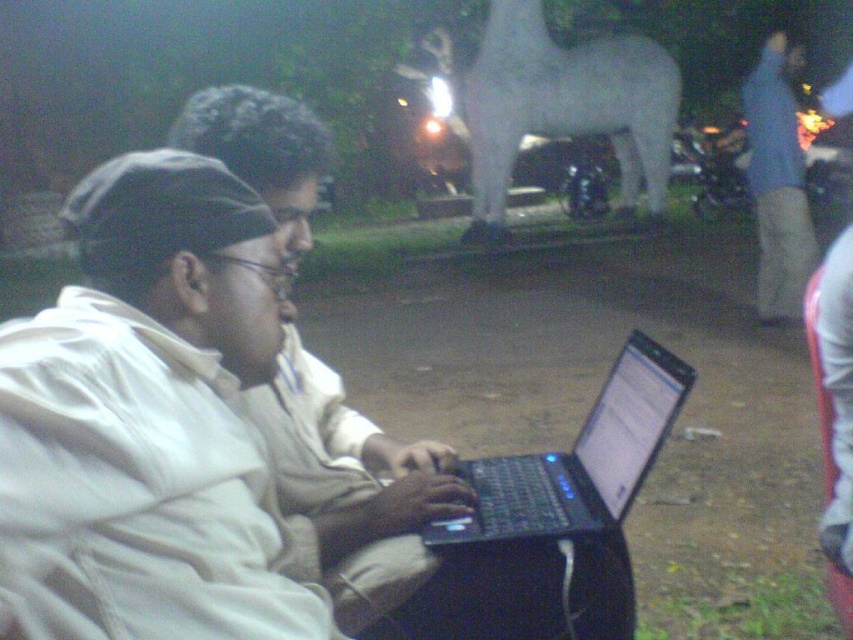
Can you confirm if white matte jacket at center is wider than black plastic laptop at center?

No, white matte jacket at center is not wider than black plastic laptop at center.

Who is positioned more to the right, white matte jacket at center or black plastic laptop at center?

From the viewer's perspective, black plastic laptop at center appears more on the right side.

Is point (33, 561) positioned behind point (666, 376)?

No, it is in front of (666, 376).

Find the location of `white matte jacket at center`. white matte jacket at center is located at coordinates (148, 422).

Between white matte jacket at center and white matte laptop at center, which one appears on the right side from the viewer's perspective?

white matte laptop at center is more to the right.

Does white matte jacket at center have a greater width compared to white matte laptop at center?

Answer: No, white matte jacket at center is not wider than white matte laptop at center.

Who is more forward, [78,605] or [405,570]?

Point [78,605] is in front.

You are a GUI agent. You are given a task and a screenshot of the screen. Output one action in this format:
    pyautogui.click(x=<x>, y=<y>)
    Task: Click on the white matte jacket at center
    
    Given the screenshot: What is the action you would take?
    pyautogui.click(x=148, y=422)

Which is more to the left, white matte laptop at center or black plastic laptop at center?

Positioned to the left is white matte laptop at center.

Between white matte laptop at center and black plastic laptop at center, which one is positioned higher?

white matte laptop at center is above.

What do you see at coordinates (393, 520) in the screenshot? I see `white matte laptop at center` at bounding box center [393, 520].

Identify the location of white matte laptop at center. This screenshot has width=853, height=640. (393, 520).